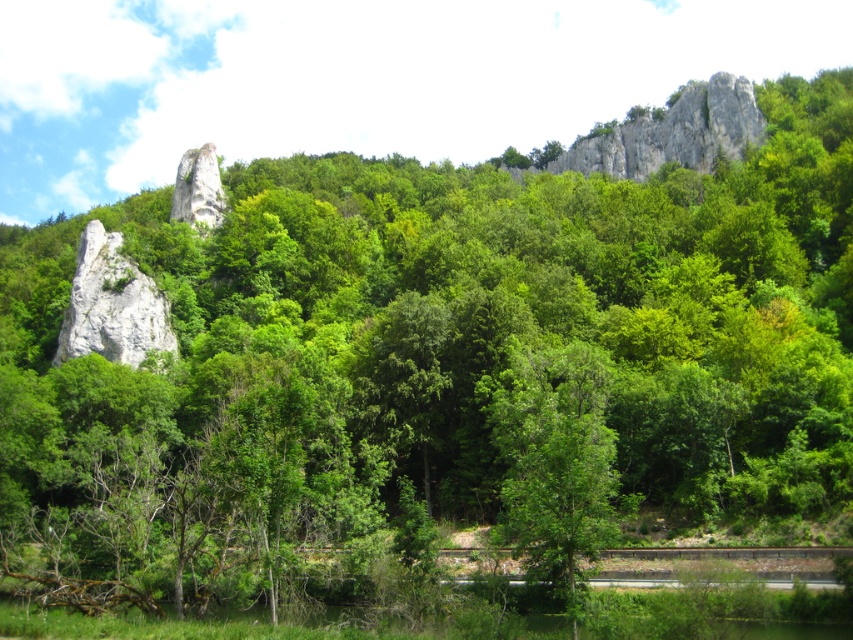
You are navigating a drone through this landscape and need to fly from the dense greenery in the foreground to the white rock formation at upper center. Based on the coordinates provided, can you determine if the flight path will pass over the manmade structure in the midground?

The white rock formation at upper center is located at coordinates point [675,132]. Since the manmade structure is in the midground and the rock formation is in the upper center, the flight path from the foreground to the rock formation would likely pass over the midground structure.

You are a hiker navigating through this forest and spot two white rough rocks. One is labeled as the white rough rock at left and the other as the white rough rock at center. From your vantage point, which rock is positioned to the right of the other?

The white rough rock at left is positioned on the right side of the white rough rock at center, meaning that from your vantage point, the white rough rock at left is to the right of the white rough rock at center.